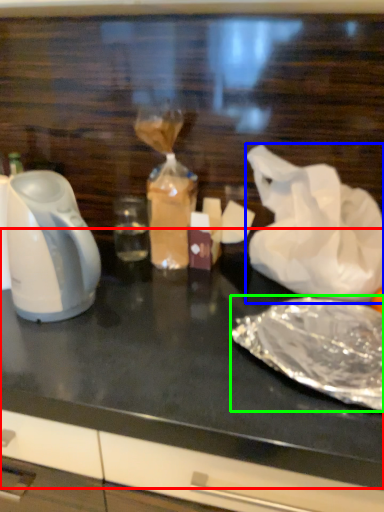
Question: Based on their relative distances, which object is farther from table top (highlighted by a red box)? Choose from plastic bag (highlighted by a blue box) and food (highlighted by a green box).

Choices:
 (A) plastic bag
 (B) food

Answer: (A)